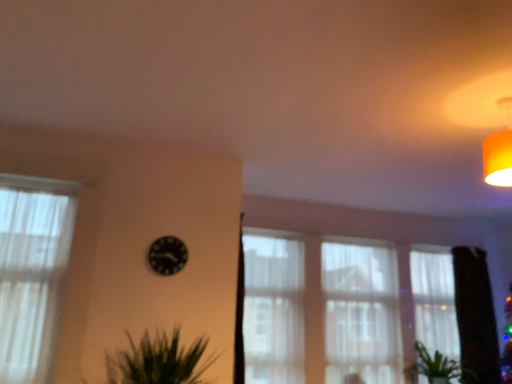
Question: Is white sheer curtain at center, the 2th curtain when ordered from left to right, placed right next to green leafy plant at lower right?

Choices:
 (A) no
 (B) yes

Answer: (A)

Question: From the image's perspective, is white sheer curtain at center, the 2th curtain when ordered from left to right, on green leafy plant at lower right?

Choices:
 (A) no
 (B) yes

Answer: (B)

Question: From the image's perspective, is white sheer curtain at center, which is counted as the second curtain, starting from the front, beneath green leafy plant at lower right?

Choices:
 (A) no
 (B) yes

Answer: (A)

Question: Is white sheer curtain at center, the 3th curtain when ordered from right to left, further to the viewer compared to green leafy plant at lower right?

Choices:
 (A) yes
 (B) no

Answer: (A)

Question: From a real-world perspective, is white sheer curtain at center, the 2th curtain when ordered from left to right, positioned under green leafy plant at lower right based on gravity?

Choices:
 (A) yes
 (B) no

Answer: (B)

Question: Is white sheer curtain at left, the fourth curtain viewed from the right, inside or outside of green matte tree at right?

Choices:
 (A) outside
 (B) inside

Answer: (A)

Question: Looking at their shapes, would you say white sheer curtain at left, the fourth curtain viewed from the right, is wider or thinner than green matte tree at right?

Choices:
 (A) wide
 (B) thin

Answer: (B)

Question: From the image's perspective, is white sheer curtain at left, arranged as the 1th curtain when viewed from the front, positioned above or below green matte tree at right?

Choices:
 (A) below
 (B) above

Answer: (B)

Question: From a real-world perspective, relative to green matte tree at right, is white sheer curtain at left, arranged as the 1th curtain when viewed from the front, vertically above or below?

Choices:
 (A) below
 (B) above

Answer: (B)

Question: Is point (269, 319) closer or farther from the camera than point (499, 147)?

Choices:
 (A) closer
 (B) farther

Answer: (B)

Question: From their relative heights in the image, would you say white sheer curtain at center, which is counted as the second curtain, starting from the front, is taller or shorter than orange fabric lampshade at upper right?

Choices:
 (A) tall
 (B) short

Answer: (A)

Question: From a real-world perspective, relative to orange fabric lampshade at upper right, is white sheer curtain at center, the third curtain positioned from the back, vertically above or below?

Choices:
 (A) above
 (B) below

Answer: (B)

Question: Considering the positions of white sheer curtain at center, the third curtain positioned from the back, and orange fabric lampshade at upper right in the image, is white sheer curtain at center, the third curtain positioned from the back, wider or thinner than orange fabric lampshade at upper right?

Choices:
 (A) thin
 (B) wide

Answer: (A)

Question: Based on their sizes in the image, would you say black glossy clock at center is bigger or smaller than white sheer curtain at right, the fourth curtain in the left-to-right sequence?

Choices:
 (A) big
 (B) small

Answer: (B)

Question: Looking at their shapes, would you say black glossy clock at center is wider or thinner than white sheer curtain at right, arranged as the 1th curtain when viewed from the back?

Choices:
 (A) thin
 (B) wide

Answer: (A)